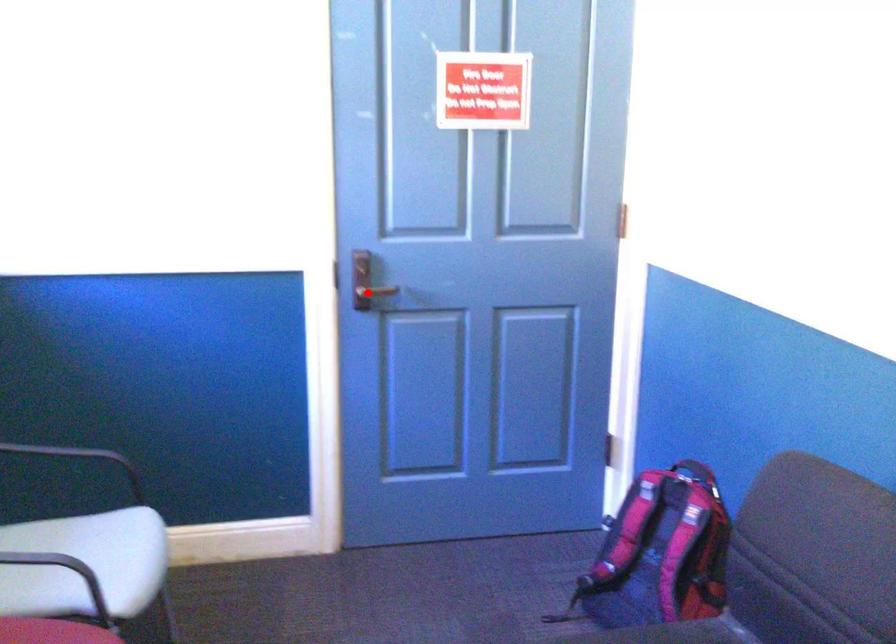
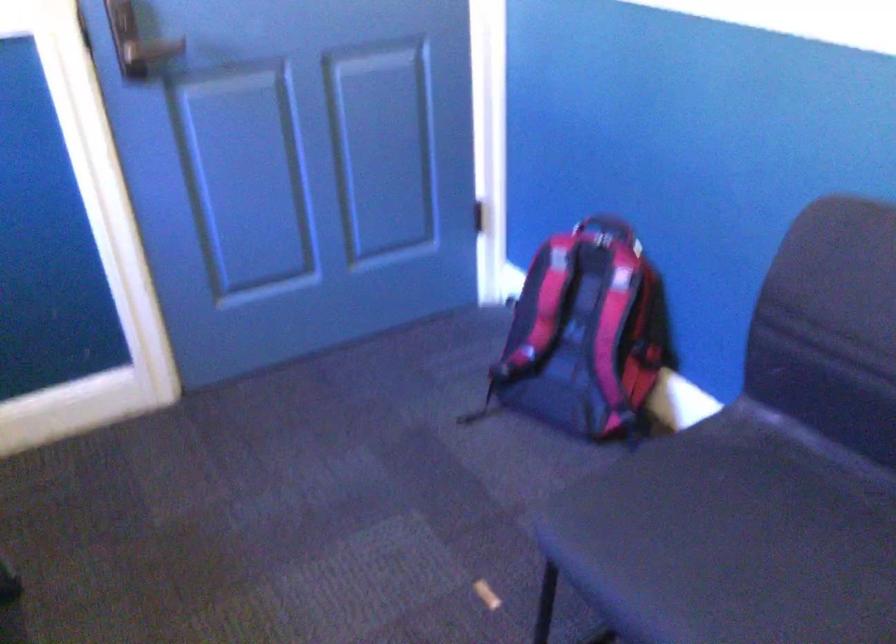
Question: I am providing you with two images of the same scene from different viewpoints. A red point is shown in image1. For the corresponding object point in image2, is it positioned nearer or farther from the camera?

Choices:
 (A) Nearer
 (B) Farther

Answer: (A)